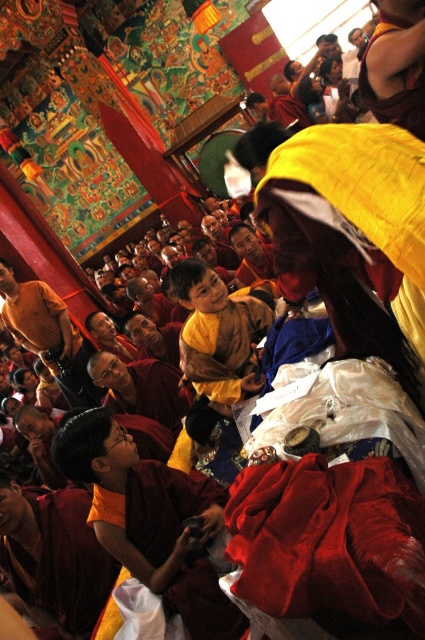
Question: Estimate the real-world distances between objects in this image. Which object is closer to the yellow cotton monk at upper right?

Choices:
 (A) orange cotton robe at lower left
 (B) velvet red cloth at lower right

Answer: (B)

Question: Is orange cotton robe at lower left wider than yellow cotton monk at upper right?

Choices:
 (A) yes
 (B) no

Answer: (A)

Question: Where is velvet red cloth at lower right located in relation to yellow cotton monk at upper right in the image?

Choices:
 (A) above
 (B) below

Answer: (B)

Question: Which object is farther from the camera taking this photo?

Choices:
 (A) yellow cotton monk at upper right
 (B) orange cotton robe at lower left
 (C) velvet red cloth at lower right

Answer: (B)

Question: Which object is positioned farthest from the yellow cotton monk at upper right?

Choices:
 (A) orange cotton robe at lower left
 (B) velvet red cloth at lower right

Answer: (A)

Question: Does velvet red cloth at lower right appear on the right side of yellow cotton monk at upper right?

Choices:
 (A) no
 (B) yes

Answer: (A)